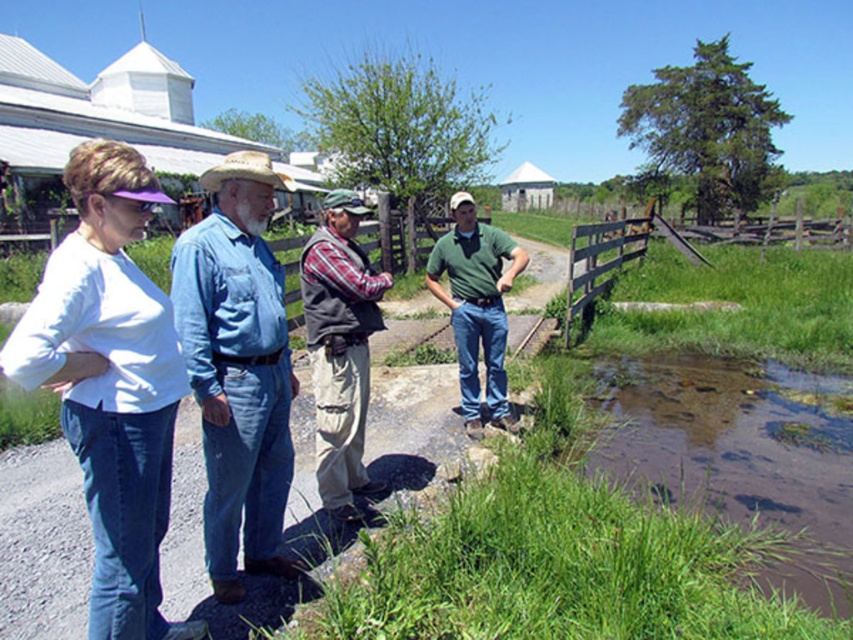
Based on the photo, you are trying to pass between the denim shirt at left and the plaid shirt vest at center. Can you fit through the space between them if you are 24 inches wide?

The denim shirt at left and plaid shirt vest at center are 28.31 inches apart, so yes, you can fit through the space between them since your width of 24 inches is less than the 28.31 inches available.

You are organizing a clothing donation drive and need to determine which of the two items, the denim shirt at left or the plaid shirt vest at center, can fit into a standard donation box that has a maximum capacity for large garments. Based on their sizes, which item is more likely to fit?

The plaid shirt vest at center is smaller than the denim shirt at left, so it is more likely to fit into the standard donation box designed for large garments.

You are a photographer trying to capture a photo of the green matte shirt at center without including the brown wooden fence at right in the frame. Based on their positions, is this possible?

The brown wooden fence at right is located above the green matte shirt at center, so adjusting the camera angle downward might exclude the fence from the frame.